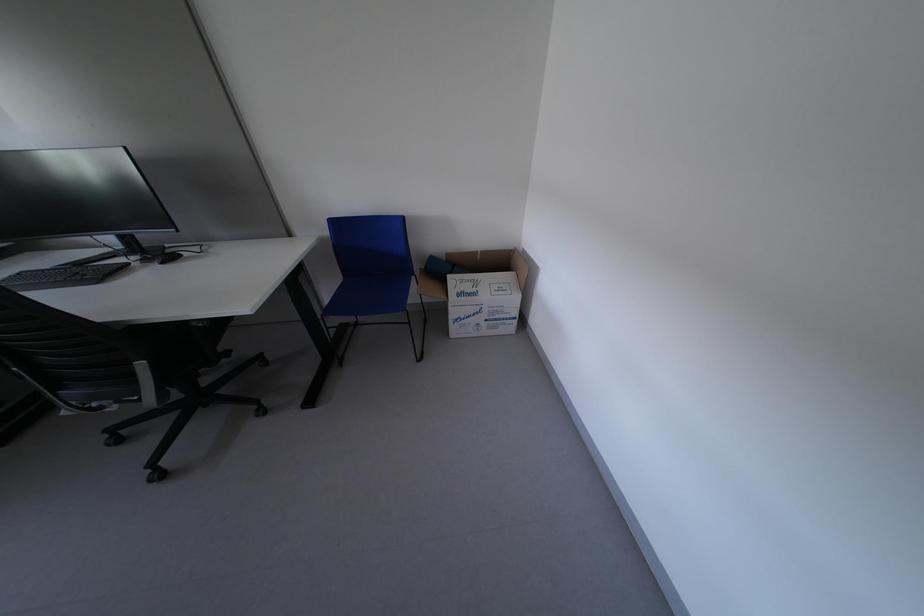
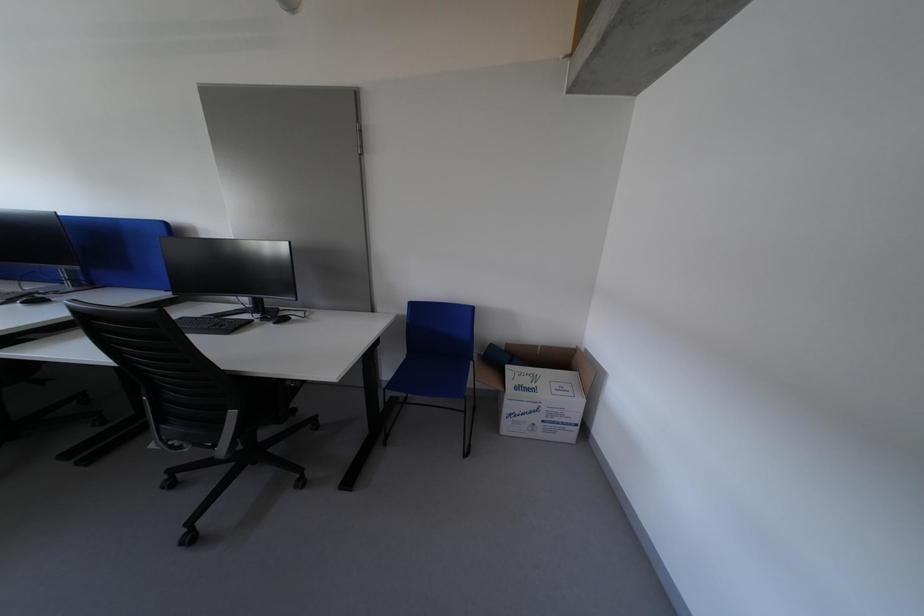
Question: The images are taken continuously from a first-person perspective. In which direction is your viewpoint rotating?

Choices:
 (A) Left
 (B) Right
 (C) Up
 (D) Down

Answer: (C)